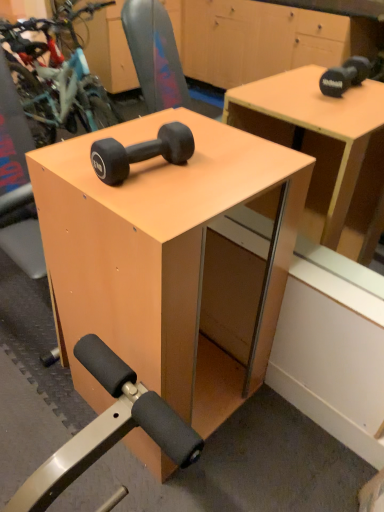
Where is `free region on the left part of matte black dumbbell at center`? free region on the left part of matte black dumbbell at center is located at coordinates (70, 160).